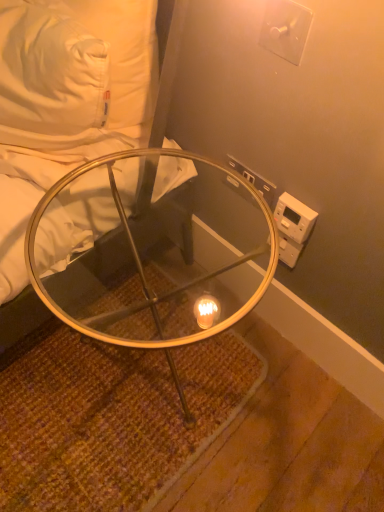
Question: Considering the relative positions of clear glass table at lower left and clear glass table at center in the image provided, is clear glass table at lower left in front of clear glass table at center?

Choices:
 (A) yes
 (B) no

Answer: (A)

Question: Is clear glass table at lower left aimed at clear glass table at center?

Choices:
 (A) yes
 (B) no

Answer: (B)

Question: From the image's perspective, does clear glass table at lower left appear higher than clear glass table at center?

Choices:
 (A) yes
 (B) no

Answer: (A)

Question: Does clear glass table at lower left have a greater height compared to clear glass table at center?

Choices:
 (A) yes
 (B) no

Answer: (B)

Question: Does clear glass table at lower left have a larger size compared to clear glass table at center?

Choices:
 (A) no
 (B) yes

Answer: (B)

Question: Is clear glass table at lower left outside clear glass table at center?

Choices:
 (A) yes
 (B) no

Answer: (A)

Question: From the image's perspective, is white plastic electrical outlet at upper right, which is the second electric outlet in front-to-back order, beneath clear glass table at lower left?

Choices:
 (A) yes
 (B) no

Answer: (A)

Question: Considering the relative sizes of white plastic electrical outlet at upper right, which is the second electric outlet in front-to-back order, and clear glass table at lower left in the image provided, is white plastic electrical outlet at upper right, which is the second electric outlet in front-to-back order, wider than clear glass table at lower left?

Choices:
 (A) yes
 (B) no

Answer: (B)

Question: Is white plastic electrical outlet at upper right, which is the second electric outlet in front-to-back order, to the right of clear glass table at lower left from the viewer's perspective?

Choices:
 (A) yes
 (B) no

Answer: (A)

Question: Is white plastic electrical outlet at upper right, positioned as the first electric outlet in bottom-to-top order, to the left of clear glass table at lower left from the viewer's perspective?

Choices:
 (A) no
 (B) yes

Answer: (A)

Question: Is white plastic electrical outlet at upper right, positioned as the first electric outlet in bottom-to-top order, placed right next to clear glass table at lower left?

Choices:
 (A) yes
 (B) no

Answer: (B)

Question: Can you confirm if white plastic electrical outlet at upper right, which is the second electric outlet in front-to-back order, is thinner than clear glass table at lower left?

Choices:
 (A) yes
 (B) no

Answer: (A)

Question: Is clear glass table at lower left a part of white plastic switch at upper right, which is the second electric outlet from back to front?

Choices:
 (A) yes
 (B) no

Answer: (B)